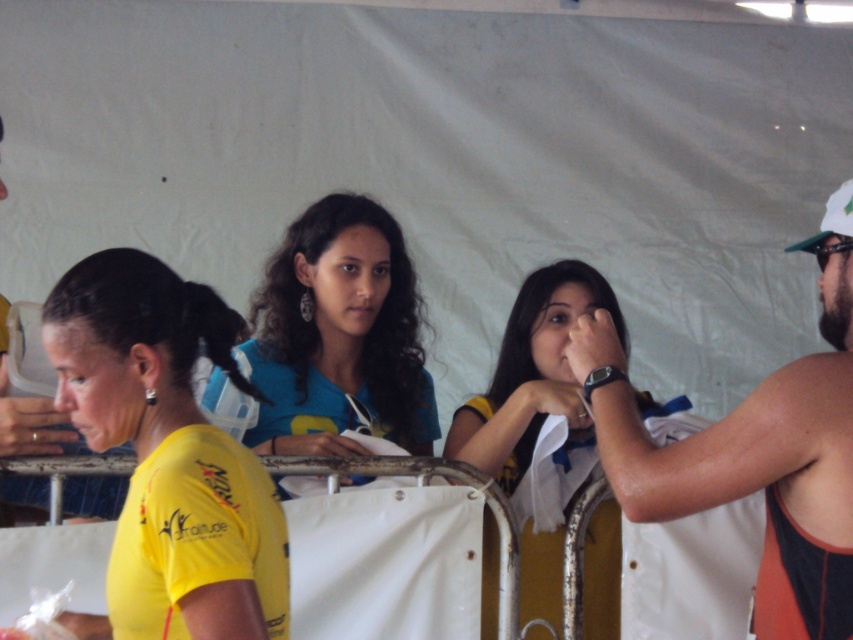
Question: Which point is closer to the camera taking this photo?

Choices:
 (A) (631, 404)
 (B) (271, 602)
 (C) (268, 310)

Answer: (B)

Question: Among these objects, which one is farthest from the camera?

Choices:
 (A) yellow matte shirt at left
 (B) matte yellow shirt at left

Answer: (B)

Question: Which is nearer to the yellow matte shirt at left?

Choices:
 (A) orange athletic tank top at right
 (B) matte yellow shirt at left
 (C) blue matte shirt at center

Answer: (B)

Question: Is orange athletic tank top at right thinner than blue matte shirt at center?

Choices:
 (A) no
 (B) yes

Answer: (B)

Question: Does yellow matte shirt at left have a lesser width compared to orange athletic tank top at right?

Choices:
 (A) no
 (B) yes

Answer: (B)

Question: Does orange athletic tank top at right have a greater width compared to matte yellow shirt at left?

Choices:
 (A) no
 (B) yes

Answer: (B)